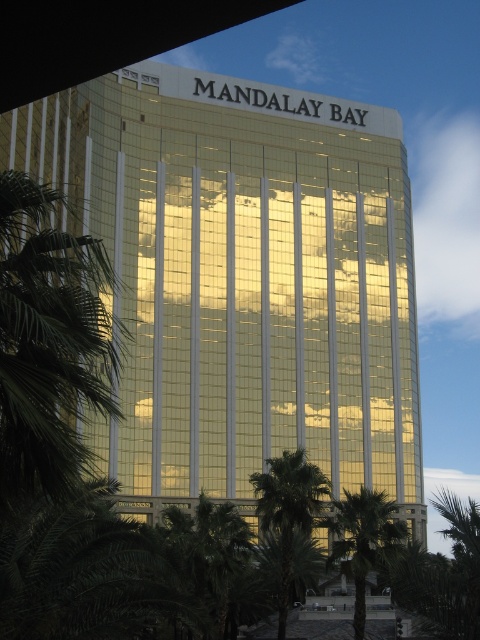
Question: Which object is closer to the camera taking this photo?

Choices:
 (A) gold reflective glass building at center
 (B) green leafy palm tree at center

Answer: (B)

Question: Is gold reflective glass building at center behind green leafy palm tree at lower center?

Choices:
 (A) no
 (B) yes

Answer: (B)

Question: Can you confirm if green leafy palm tree at lower center is bigger than green leafy palm tree at center?

Choices:
 (A) yes
 (B) no

Answer: (A)

Question: Which is nearer to the green leafy palm tree at center?

Choices:
 (A) green leafy palm tree at lower center
 (B) gold reflective glass building at center

Answer: (A)

Question: Does green leafy palm tree at lower center have a smaller size compared to green leafy palm tree at center?

Choices:
 (A) no
 (B) yes

Answer: (A)

Question: Which point appears farthest from the camera in this image?

Choices:
 (A) (271, 464)
 (B) (211, 378)

Answer: (B)